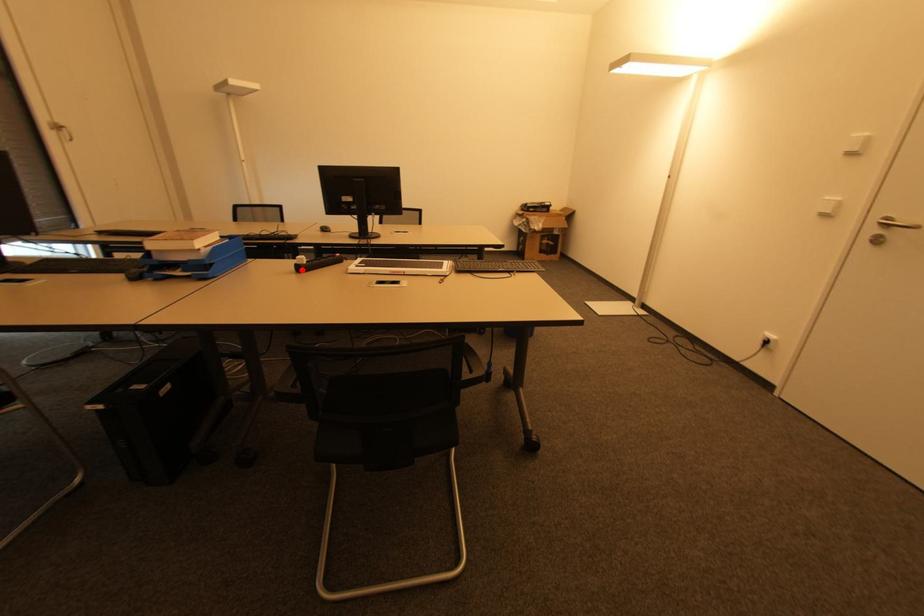
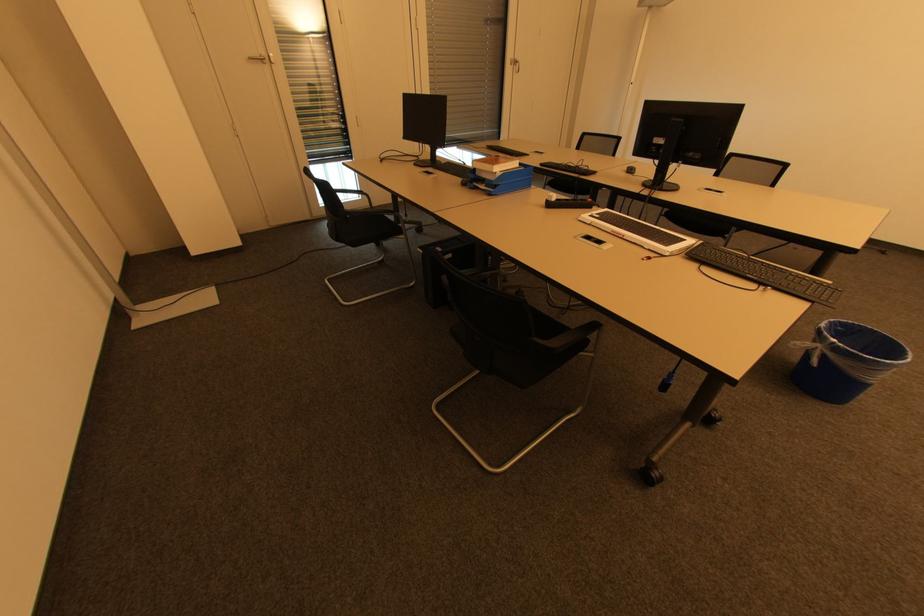
Question: I am providing you with two images of the same scene from different viewpoints. Given a red point in image1, look at the same physical point in image2. Is it:

Choices:
 (A) Closer to the viewpoint
 (B) Farther from the viewpoint

Answer: (A)